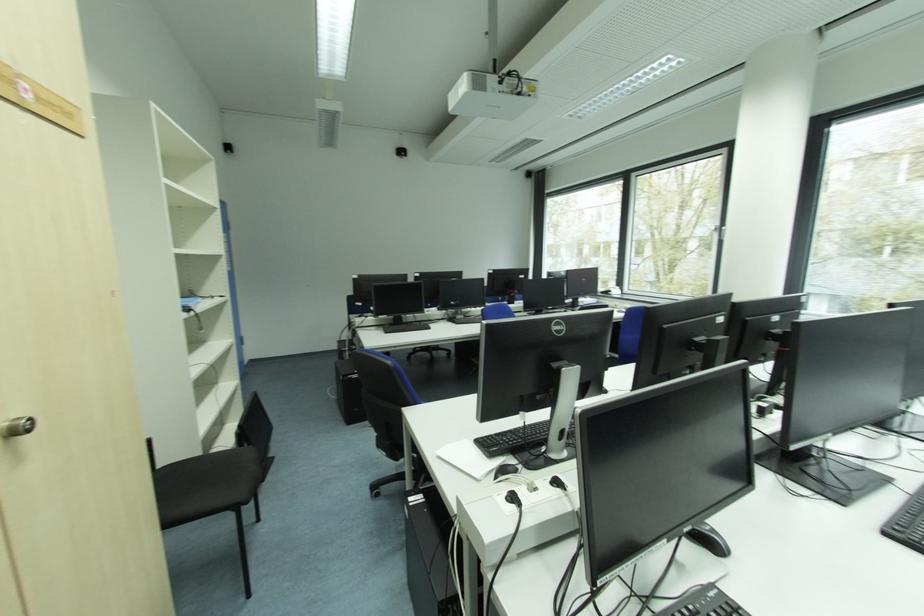
The image size is (924, 616). I want to click on chair sitting surface, so click(x=208, y=480).